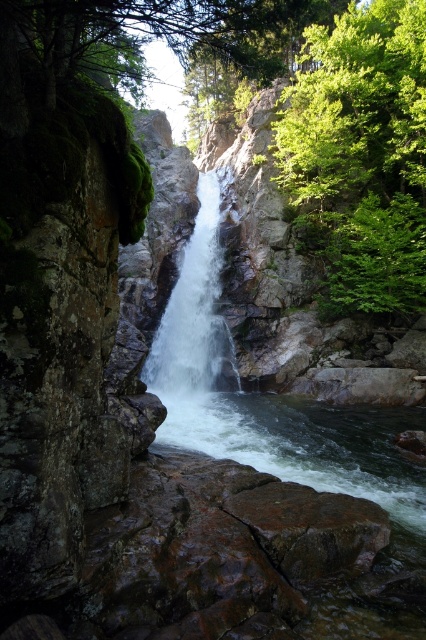
Based on the photo, you are standing at the edge of the cliff overlooking the waterfall. There is a point marked at coordinates (x=307, y=444). Based on the scene description, what is the significance of this point?

The point at coordinates (x=307, y=444) marks clear water at center, indicating the location where the water is most transparent and free of obstructions in the waterfall scene.

You are a hiker who wants to take a photo of the waterfall. You have a camera with a standard lens that can capture a scene up to 10 meters wide. The green leafy tree at right and the clear water at center are both in your viewfinder. Which object takes up more space in your photo?

The green leafy tree at right takes up more space in the photo because it is bigger than the clear water at center according to the description.

You are standing at the edge of the pool below the waterfall. You want to walk to the green leafy tree at right and then to the white smooth waterfall at center. Which path will require you to go uphill?

The path to the white smooth waterfall at center will require going uphill because the waterfall is located higher up on the cliff compared to the green leafy tree at right, which is closer to the viewer at the pool level.